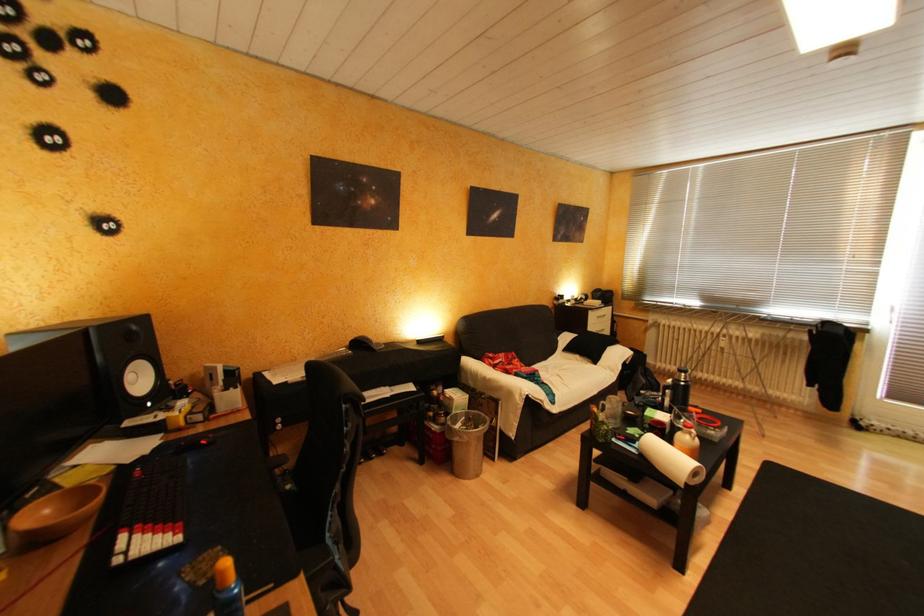
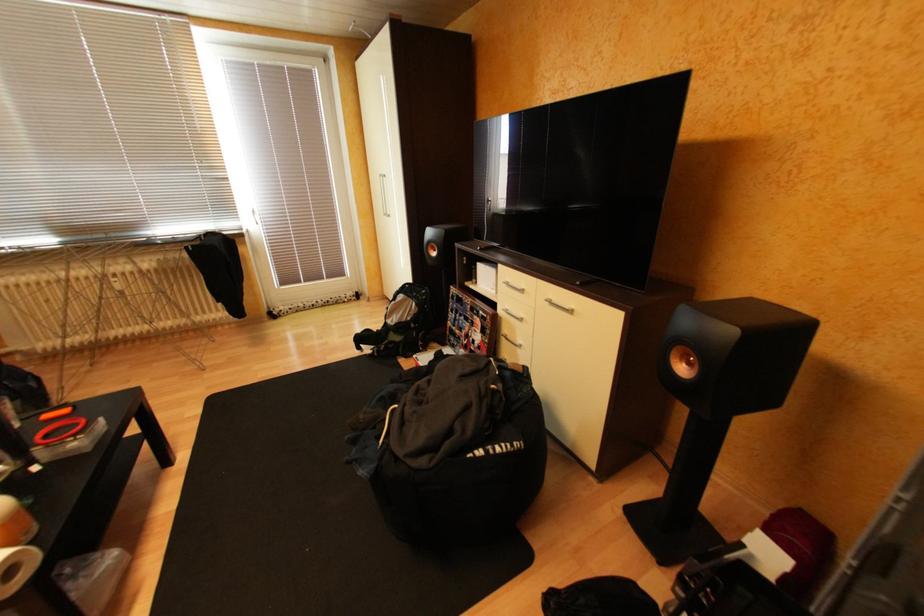
The first image is from the beginning of the video and the second image is from the end. How did the camera likely rotate when shooting the video?

The rotation direction of the camera is right-down.